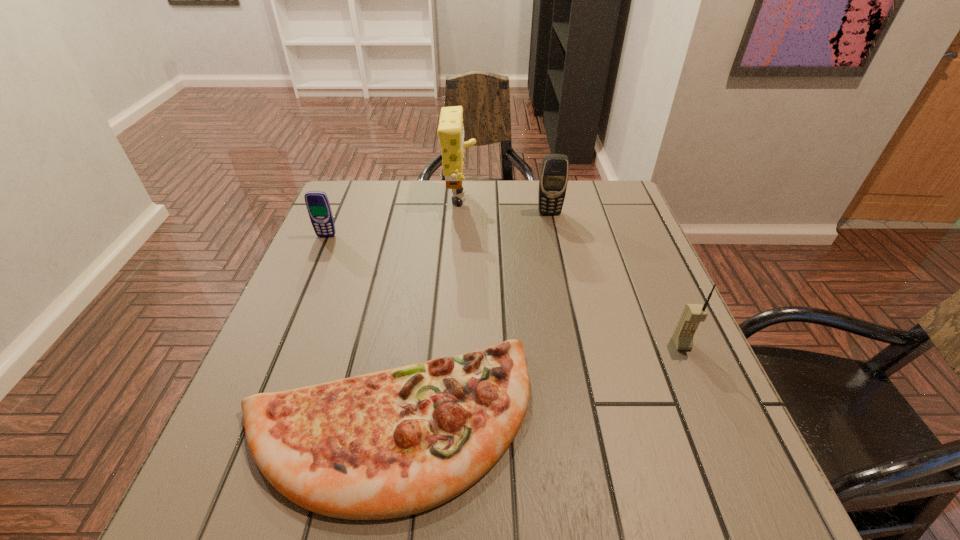
In order to click on object present at the near left corner in this screenshot , I will do `click(394, 443)`.

The height and width of the screenshot is (540, 960). I want to click on vacant region at the far edge of the desktop, so click(508, 188).

I want to click on vacant space at the near edge of the desktop, so click(520, 516).

Locate an element on the screen. The width and height of the screenshot is (960, 540). free spot at the left edge of the desktop is located at coordinates (316, 273).

Find the location of `free point at the right edge`. free point at the right edge is located at coordinates (617, 282).

In the image, there is a desktop. At what (x,y) coordinates should I click in order to perform the action: click on free space at the far left corner. Please return your answer as a coordinate pair (x, y). Image resolution: width=960 pixels, height=540 pixels. Looking at the image, I should click on (345, 186).

This screenshot has width=960, height=540. In order to click on vacant space at the near right corner of the desktop in this screenshot , I will do `click(684, 505)`.

The height and width of the screenshot is (540, 960). What are the coordinates of `vacant point located between the shortest object and the tallest object` in the screenshot? It's located at (423, 313).

The image size is (960, 540). In order to click on free area in between the nearest object and the third farthest object in this screenshot , I will do `click(356, 330)`.

Locate an element on the screen. The height and width of the screenshot is (540, 960). free point between the second cellular telephone from left to right and the third nearest object is located at coordinates (438, 225).